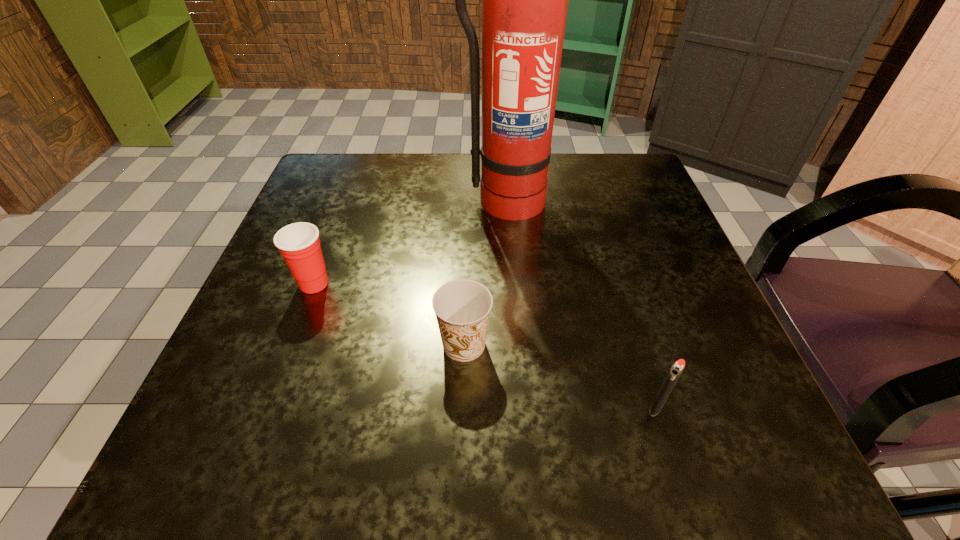
The width and height of the screenshot is (960, 540). I want to click on fire extinguisher, so click(x=524, y=0).

At what (x,y) coordinates should I click in order to perform the action: click on the tallest object. Please return your answer as a coordinate pair (x, y). This screenshot has height=540, width=960. Looking at the image, I should click on (524, 0).

This screenshot has width=960, height=540. Identify the location of the leftmost object. (299, 244).

You are a GUI agent. You are given a task and a screenshot of the screen. Output one action in this format:
    pyautogui.click(x=<x>, y=<y>)
    Task: Click on the left Dixie cup
    The image size is (960, 540).
    Given the screenshot: What is the action you would take?
    pyautogui.click(x=299, y=244)

This screenshot has height=540, width=960. Find the location of `the rightmost object`. the rightmost object is located at coordinates (676, 370).

Where is `igniter`? Image resolution: width=960 pixels, height=540 pixels. igniter is located at coordinates (676, 370).

At what (x,y) coordinates should I click in order to perform the action: click on the right Dixie cup. Please return your answer as a coordinate pair (x, y). Image resolution: width=960 pixels, height=540 pixels. Looking at the image, I should click on (462, 307).

This screenshot has width=960, height=540. I want to click on the third farthest object, so click(x=462, y=307).

Where is `free space located 0.250m on the label side of the tallest object`? The height and width of the screenshot is (540, 960). free space located 0.250m on the label side of the tallest object is located at coordinates (512, 319).

Find the location of a particular element. The width and height of the screenshot is (960, 540). blank area located 0.100m on the front of the farther Dixie cup is located at coordinates (290, 348).